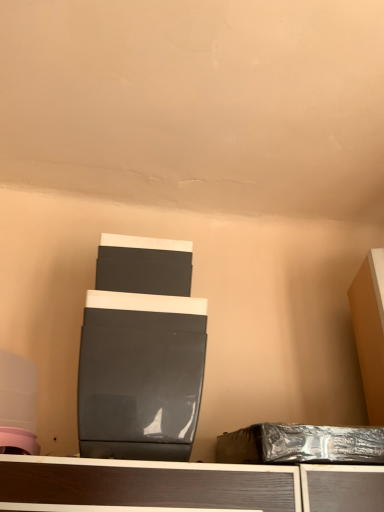
Question: Considering the relative positions of glossy black speaker at center and shiny metallic box at lower right in the image provided, is glossy black speaker at center to the left or to the right of shiny metallic box at lower right?

Choices:
 (A) right
 (B) left

Answer: (B)

Question: Which is correct: glossy black speaker at center is inside shiny metallic box at lower right, or outside of it?

Choices:
 (A) outside
 (B) inside

Answer: (A)

Question: Estimate the real-world distances between objects in this image. Which object is farther from the glossy black speaker at center?

Choices:
 (A) matte orange cabinet at right
 (B) shiny metallic box at lower right

Answer: (A)

Question: Considering the real-world distances, which object is farthest from the shiny metallic box at lower right?

Choices:
 (A) matte orange cabinet at right
 (B) glossy black speaker at center

Answer: (A)